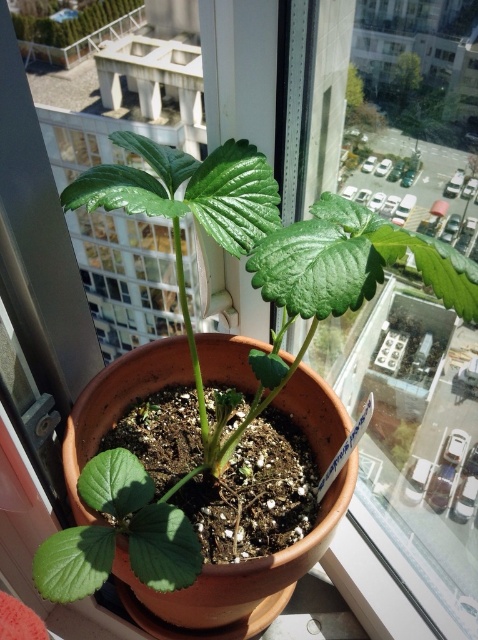
You are a gardener inspecting the potted plant. You notice the green matte leaf at lower left and the green matte plant at upper center. Which one has a taller height?

The green matte leaf at lower left has a greater height compared to the green matte plant at upper center.

You are a gardener who wants to trim the green matte leaf at lower left to make space for the green matte plant at center to grow. Since the plant is taller, should you trim the leaf?

The green matte plant at center is taller than the green matte leaf at lower left, so trimming the leaf may not be necessary as it is already shorter and not obstructing the plant.